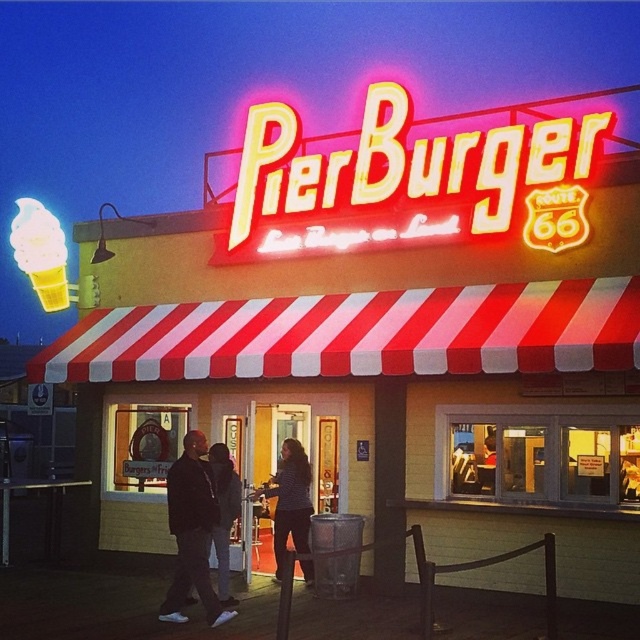
Question: Among these objects, which one is nearest to the camera?

Choices:
 (A) striped shirt at center
 (B) neon yellow sign at upper center
 (C) shiny yellow ice cream cone at left
 (D) red/white striped awning at center

Answer: (D)

Question: Does red/white striped awning at center appear on the left side of dark gray pants at center?

Choices:
 (A) yes
 (B) no

Answer: (B)

Question: Is the position of dark gray pants at center more distant than that of shiny yellow ice cream cone at left?

Choices:
 (A) yes
 (B) no

Answer: (B)

Question: Based on their relative distances, which object is nearer to the dark gray jacket at center?

Choices:
 (A) striped shirt at center
 (B) shiny yellow ice cream cone at left
 (C) red/white striped awning at center
 (D) dark gray pants at center

Answer: (D)

Question: Among these points, which one is nearest to the camera?

Choices:
 (A) (192, 486)
 (B) (566, 312)
 (C) (284, 509)
 (D) (369, 99)

Answer: (A)

Question: Is striped shirt at center to the right of dark gray jacket at center from the viewer's perspective?

Choices:
 (A) yes
 (B) no

Answer: (A)